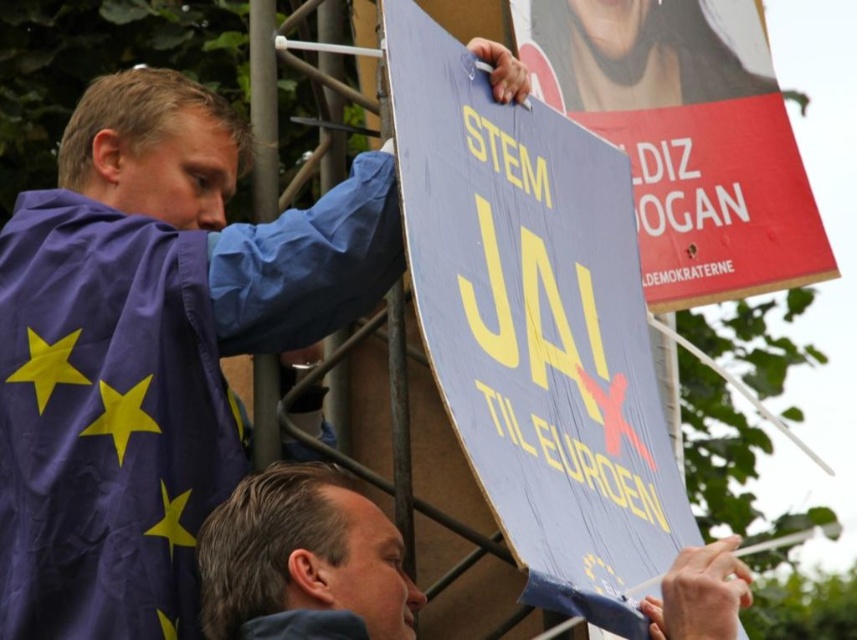
Question: Which object appears closest to the camera in this image?

Choices:
 (A) purple fabric robe at upper left
 (B) smooth blue sign at center

Answer: (B)

Question: Among these points, which one is nearest to the camera?

Choices:
 (A) (676, 618)
 (B) (559, 452)
 (C) (156, 588)

Answer: (A)

Question: Where is purple fabric robe at upper left located in relation to smooth blue sign at center in the image?

Choices:
 (A) right
 (B) left

Answer: (B)

Question: Does purple fabric robe at upper left come behind smooth blue sign at center?

Choices:
 (A) yes
 (B) no

Answer: (A)

Question: Which object appears farthest from the camera in this image?

Choices:
 (A) smooth blue sign at center
 (B) wooden sign at center
 (C) purple fabric robe at upper left

Answer: (C)

Question: Is wooden sign at center to the left of smooth blue sign at center from the viewer's perspective?

Choices:
 (A) no
 (B) yes

Answer: (A)